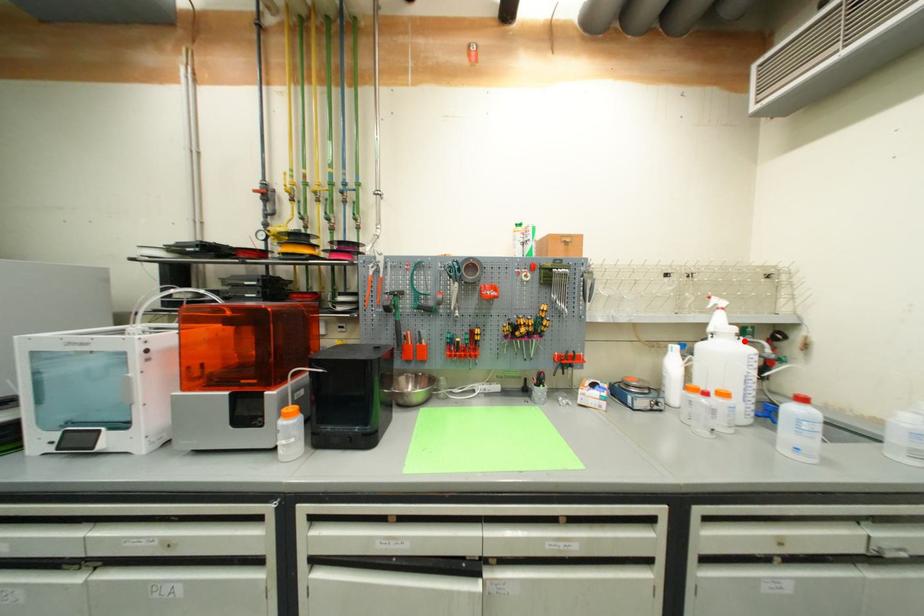
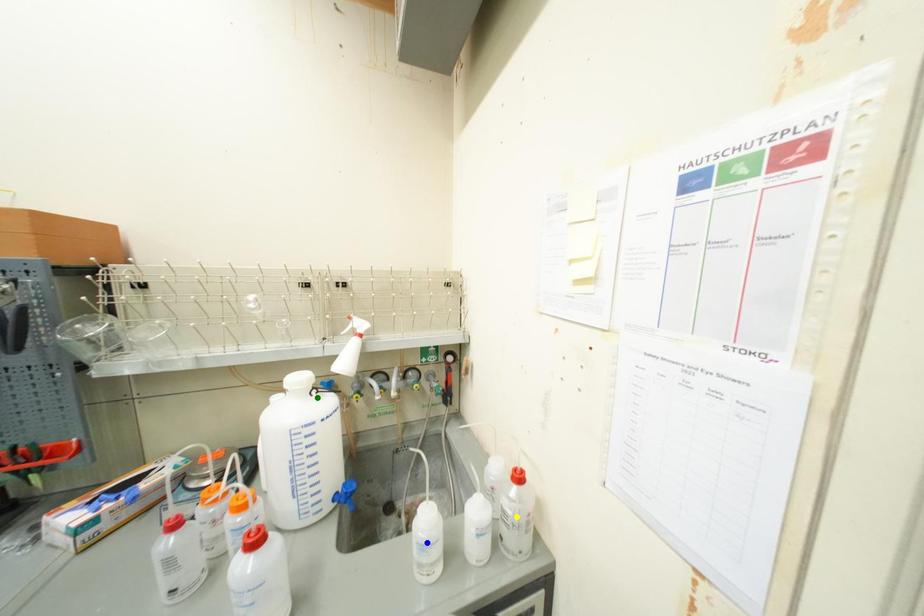
Question: I am providing you with two images of the same scene from different viewpoints. A red point is marked on the first image. You are given multiple points on the second image. In image 2, which mark is for the same physical point as the one in image 1?

Choices:
 (A) yellow point
 (B) green point
 (C) blue point

Answer: (B)